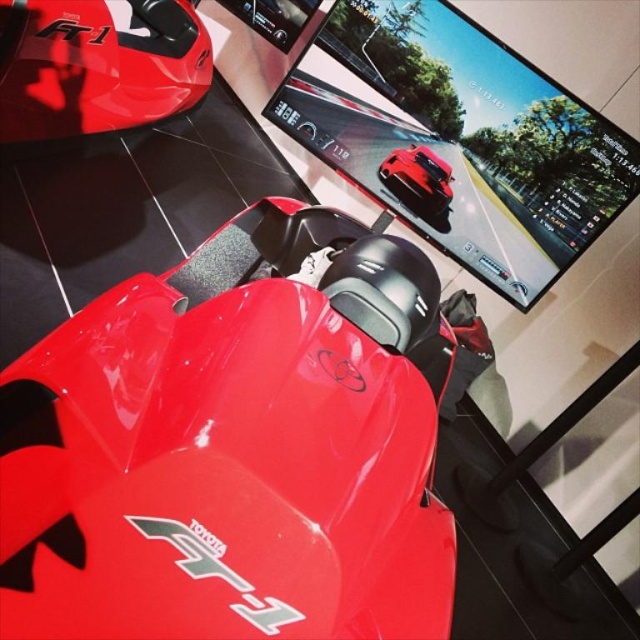
Between point (136, 342) and point (413, 172), which one is positioned in front?

Point (136, 342)

I want to click on glossy red sports car at center, so click(x=236, y=445).

Is point (444, 61) positioned before point (65, 72)?

No.

Between point (400, 17) and point (32, 88), which one is positioned behind?

The point (400, 17) is more distant.

I want to click on glossy plastic monitor at upper center, so click(x=461, y=136).

Where is `glossy plastic monitor at upper center`? The width and height of the screenshot is (640, 640). glossy plastic monitor at upper center is located at coordinates (461, 136).

Between glossy red sports car at center and glossy red sports car at upper left, which one is positioned higher?

glossy red sports car at upper left is above.

Is point (321, 580) positioned in front of point (156, 67)?

Yes, it is.

The width and height of the screenshot is (640, 640). In order to click on glossy red sports car at center in this screenshot , I will do `click(236, 445)`.